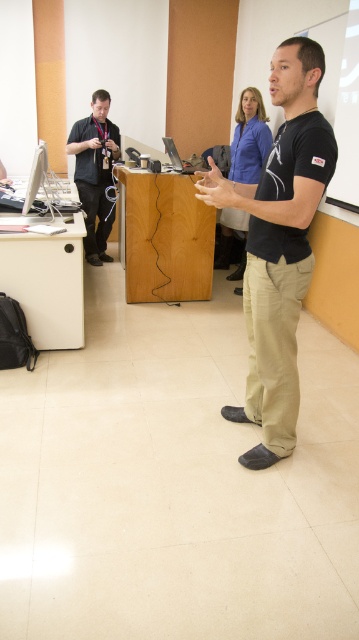
Question: Among these objects, which one is farthest from the camera?

Choices:
 (A) matte black lanyard at left
 (B) black matte shirt at center

Answer: (A)

Question: Where is black cotton shirt at center located in relation to silver metallic laptop at center in the image?

Choices:
 (A) below
 (B) above

Answer: (A)

Question: Can you confirm if black cotton shirt at center is positioned below silver metallic laptop at center?

Choices:
 (A) yes
 (B) no

Answer: (A)

Question: Among these points, which one is nearest to the camera?

Choices:
 (A) (305, 264)
 (B) (188, 164)
 (C) (257, 99)
 (D) (82, 163)

Answer: (A)

Question: Estimate the real-world distances between objects in this image. Which object is closer to the matte black lanyard at left?

Choices:
 (A) black cotton shirt at center
 (B) silver metallic laptop at center
 (C) black matte shirt at center

Answer: (B)

Question: Considering the relative positions of black cotton shirt at center and black matte shirt at center in the image provided, where is black cotton shirt at center located with respect to black matte shirt at center?

Choices:
 (A) right
 (B) left

Answer: (B)